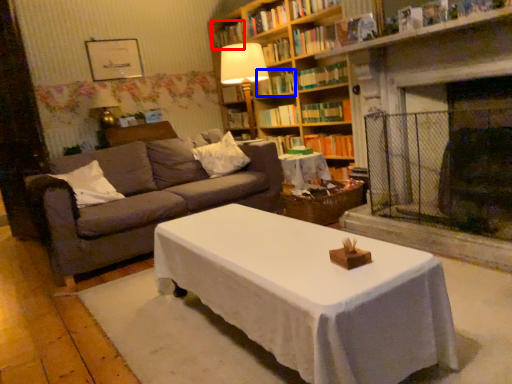
Question: Which object is closer to the camera taking this photo, book (highlighted by a red box) or book (highlighted by a blue box)?

Choices:
 (A) book
 (B) book

Answer: (B)